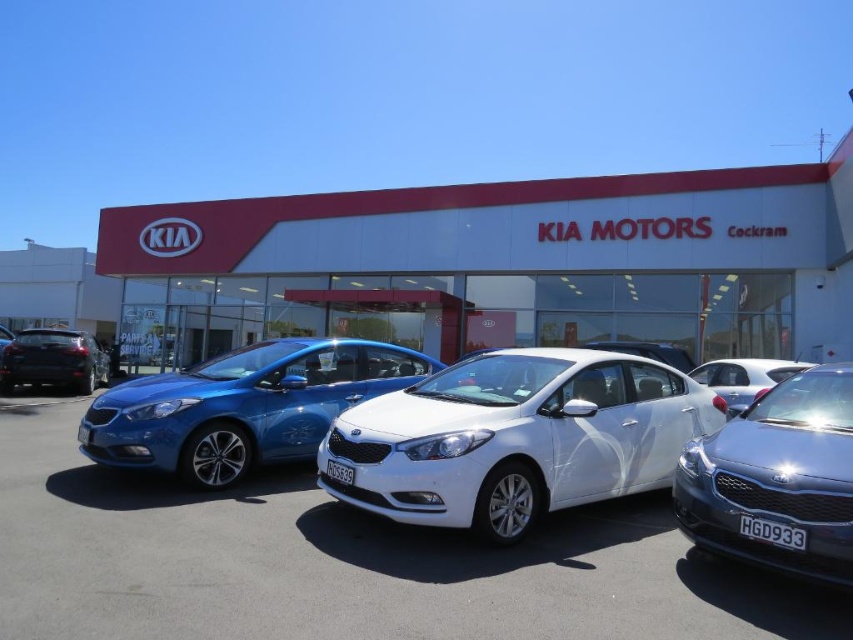
You are a customer standing in front of the Kia Motors dealership. You see the white glossy car at center and the satin silver sedan at center. Which car is closer to you?

The white glossy car at center is closer to you because it is further to the viewer than the satin silver sedan at center.

You are a delivery person needing to park a 1.8m wide delivery van between the satin silver sedan at center and the matte black sedan at left. Can you fit the van between them based on their widths?

The satin silver sedan at center has a lesser width compared to the matte black sedan at left, so the space between them may be sufficient for the 1.8m wide delivery van. However, exact measurements are needed to confirm.